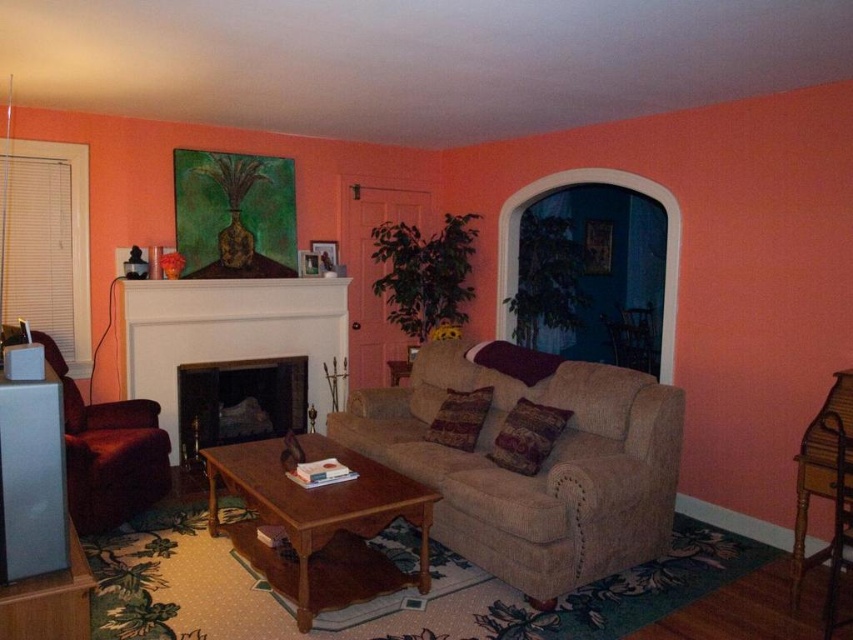
Question: Considering the relative positions of matte black fireplace at center and wooden chair at right in the image provided, where is matte black fireplace at center located with respect to wooden chair at right?

Choices:
 (A) below
 (B) above

Answer: (B)

Question: Is matte black fireplace at center further to the viewer compared to wooden chair at right?

Choices:
 (A) no
 (B) yes

Answer: (B)

Question: Among these points, which one is nearest to the camera?

Choices:
 (A) (167, 412)
 (B) (73, 449)
 (C) (844, 620)

Answer: (C)

Question: Which point is farther to the camera?

Choices:
 (A) velvet maroon armchair at left
 (B) wooden chair at right

Answer: (A)

Question: Which point appears closest to the camera in this image?

Choices:
 (A) (280, 364)
 (B) (148, 428)
 (C) (828, 582)
 (D) (799, 451)

Answer: (C)

Question: Can you confirm if brown wood coffee table at center is positioned above wooden chair at center?

Choices:
 (A) yes
 (B) no

Answer: (B)